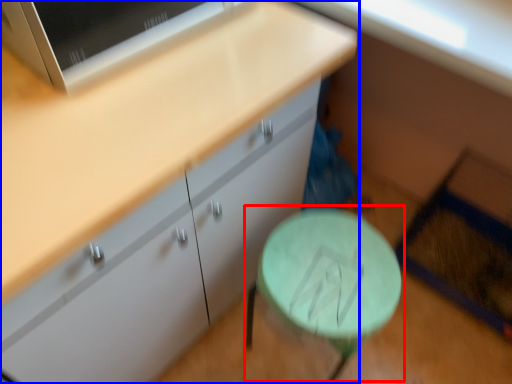
Question: Which of the following is the farthest to the observer, round table (highlighted by a red box) or cabinetry (highlighted by a blue box)?

Choices:
 (A) round table
 (B) cabinetry

Answer: (A)